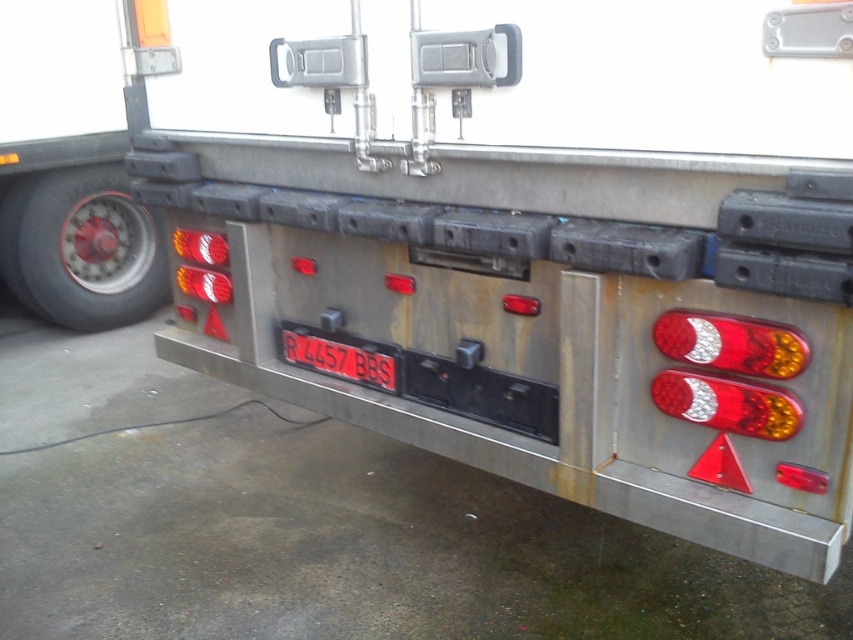
Can you confirm if matte plastic brake light at right is positioned below black plastic license plate at center?

No, matte plastic brake light at right is not below black plastic license plate at center.

Can you confirm if matte plastic brake light at right is taller than black plastic license plate at center?

No.

Which is in front, point (772, 342) or point (386, 365)?

Positioned in front is point (772, 342).

You are a GUI agent. You are given a task and a screenshot of the screen. Output one action in this format:
    pyautogui.click(x=<x>, y=<y>)
    Task: Click on the matte plastic brake light at right
    The width and height of the screenshot is (853, 640).
    Given the screenshot: What is the action you would take?
    point(730,342)

Can you confirm if translucent plastic brake light at right is shorter than black plastic license plate at center?

Correct, translucent plastic brake light at right is not as tall as black plastic license plate at center.

Who is shorter, translucent plastic brake light at right or black plastic license plate at center?

translucent plastic brake light at right

You are a GUI agent. You are given a task and a screenshot of the screen. Output one action in this format:
    pyautogui.click(x=<x>, y=<y>)
    Task: Click on the translucent plastic brake light at right
    This screenshot has height=640, width=853.
    Given the screenshot: What is the action you would take?
    pyautogui.click(x=727, y=404)

Between matte plastic brake light at right and translucent plastic brake light at right, which one has less height?

Standing shorter between the two is translucent plastic brake light at right.

Who is more forward, [740,323] or [689,392]?

Point [740,323] is more forward.

At what (x,y) coordinates should I click in order to perform the action: click on matte plastic brake light at right. Please return your answer as a coordinate pair (x, y). The height and width of the screenshot is (640, 853). Looking at the image, I should click on (730, 342).